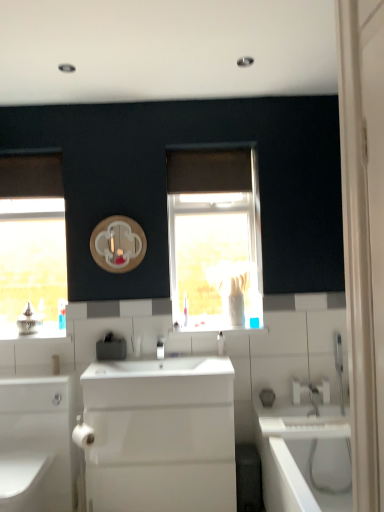
Locate an element on the screen. The height and width of the screenshot is (512, 384). vacant space to the right of white glossy tap at center is located at coordinates (184, 358).